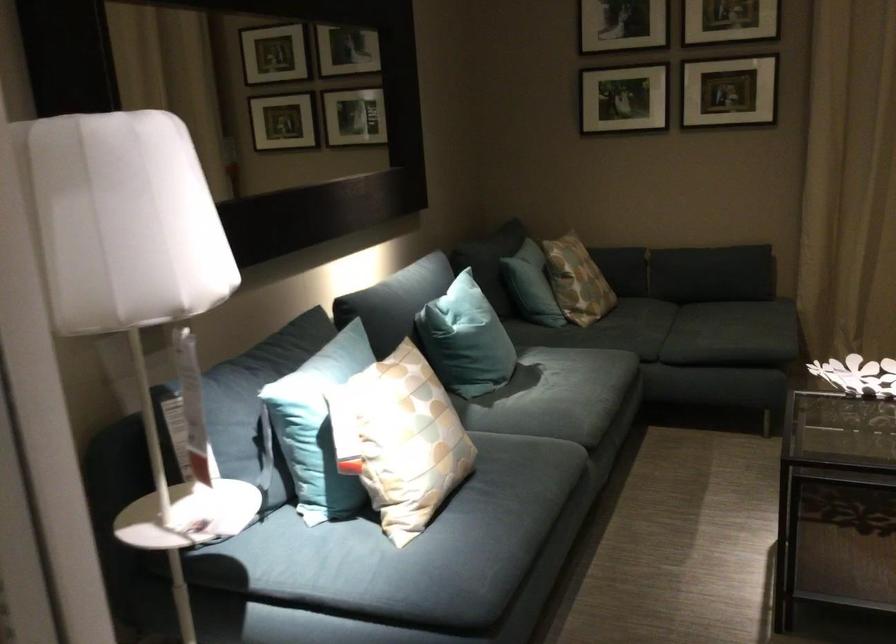
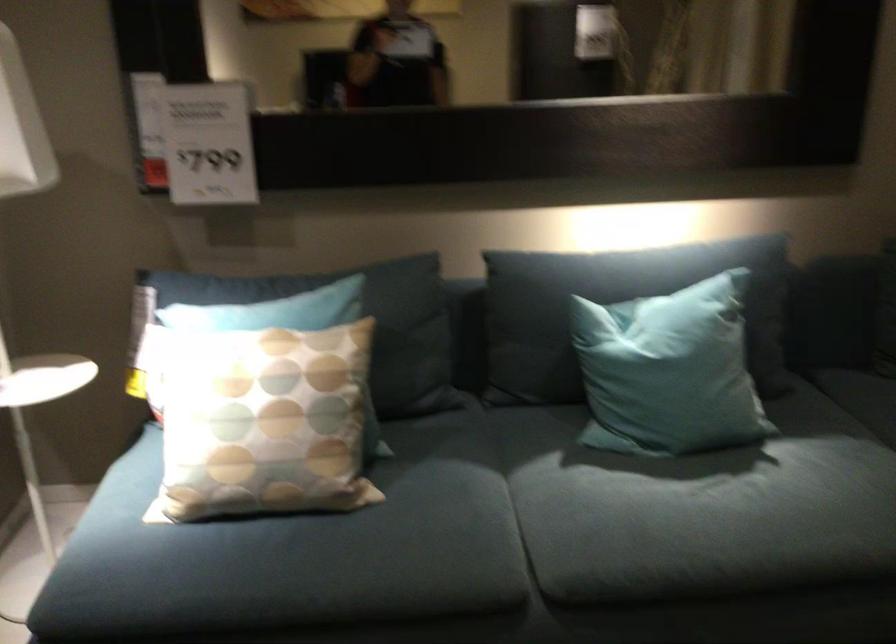
Where in the second image is the point corresponding to (431,313) from the first image?

(616, 308)